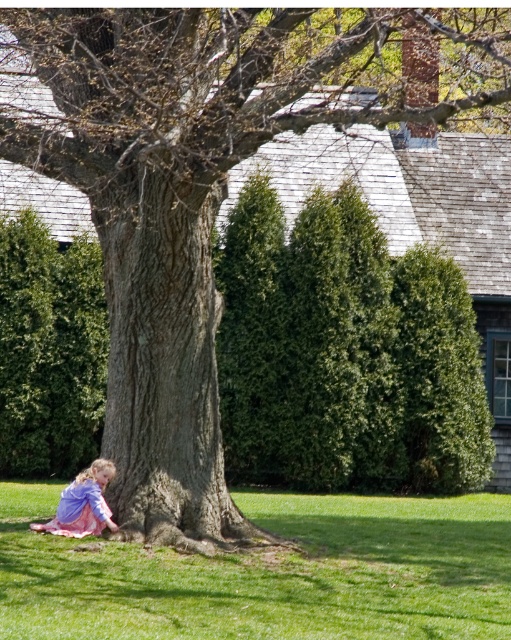
You are a photographer wanting to capture the pink satin dress at lower left and the green grass at lower left in your shot. Since you want to focus on the dress, which object should you move closer to in order to make the dress appear larger in the photo?

To make the pink satin dress at lower left appear larger in the photo, you should move closer to the pink satin dress at lower left. Since the green grass at lower left is larger in size, moving closer to the dress will help it dominate the frame and appear bigger relative to the grass.

You are standing at the point with coordinates point (63,515) and want to walk towards the house. Is the point (267,497) blocking your path?

Point (267,497) is behind point (63,515), so it is not blocking your path. You can walk towards the house without obstruction.

You are a photographer standing in front of the scene. You want to take a photo that includes both the green grass at lower left and the pink satin dress at lower left. Which object should you focus on first to ensure both are in clear view?

The green grass at lower left is closer to the viewer than the pink satin dress at lower left. To ensure both are in clear view, focus on the green grass at lower left first, as it is nearer, and adjust the depth of field to include the pink satin dress at lower left in the background.